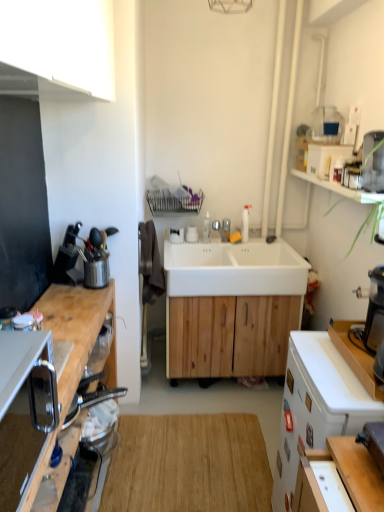
Question: Is white matte cabinet at upper left, placed as the second cabinetry when sorted from bottom to top, positioned before natural wood cutting board at center?

Choices:
 (A) yes
 (B) no

Answer: (A)

Question: Is white matte cabinet at upper left, arranged as the 1th cabinetry when viewed from the top, looking in the opposite direction of natural wood cutting board at center?

Choices:
 (A) no
 (B) yes

Answer: (A)

Question: Could natural wood cutting board at center be considered to be inside white matte cabinet at upper left, arranged as the 1th cabinetry when viewed from the top?

Choices:
 (A) yes
 (B) no

Answer: (B)

Question: From the image's perspective, is white matte cabinet at upper left, arranged as the 1th cabinetry when viewed from the top, above natural wood cutting board at center?

Choices:
 (A) no
 (B) yes

Answer: (B)

Question: From the image's perspective, is white matte cabinet at upper left, arranged as the 1th cabinetry when viewed from the top, under natural wood cutting board at center?

Choices:
 (A) no
 (B) yes

Answer: (A)

Question: Considering the positions of white matte counter top at right and white matte desk at right in the image, is white matte counter top at right taller or shorter than white matte desk at right?

Choices:
 (A) tall
 (B) short

Answer: (B)

Question: From the image's perspective, is white matte counter top at right positioned above or below white matte desk at right?

Choices:
 (A) below
 (B) above

Answer: (B)

Question: Considering their positions, is white matte counter top at right located in front of or behind white matte desk at right?

Choices:
 (A) behind
 (B) front

Answer: (B)

Question: Is white matte counter top at right to the left or to the right of white matte desk at right in the image?

Choices:
 (A) right
 (B) left

Answer: (A)

Question: In terms of width, does white matte sink at center look wider or thinner when compared to white matte cabinet at upper left, placed as the second cabinetry when sorted from bottom to top?

Choices:
 (A) thin
 (B) wide

Answer: (B)

Question: Considering the relative positions of white matte sink at center and white matte cabinet at upper left, placed as the second cabinetry when sorted from bottom to top, in the image provided, is white matte sink at center to the left or to the right of white matte cabinet at upper left, placed as the second cabinetry when sorted from bottom to top,?

Choices:
 (A) left
 (B) right

Answer: (B)

Question: From their relative heights in the image, would you say white matte sink at center is taller or shorter than white matte cabinet at upper left, placed as the second cabinetry when sorted from bottom to top?

Choices:
 (A) short
 (B) tall

Answer: (A)

Question: Do you think white matte sink at center is within white matte cabinet at upper left, placed as the second cabinetry when sorted from bottom to top, or outside of it?

Choices:
 (A) outside
 (B) inside

Answer: (A)

Question: Choose the correct answer: Is white matte cabinet at upper left, arranged as the 1th cabinetry when viewed from the top, inside white glossy faucet at center or outside it?

Choices:
 (A) inside
 (B) outside

Answer: (B)

Question: In the image, is white matte cabinet at upper left, arranged as the 1th cabinetry when viewed from the top, on the left side or the right side of white glossy faucet at center?

Choices:
 (A) left
 (B) right

Answer: (A)